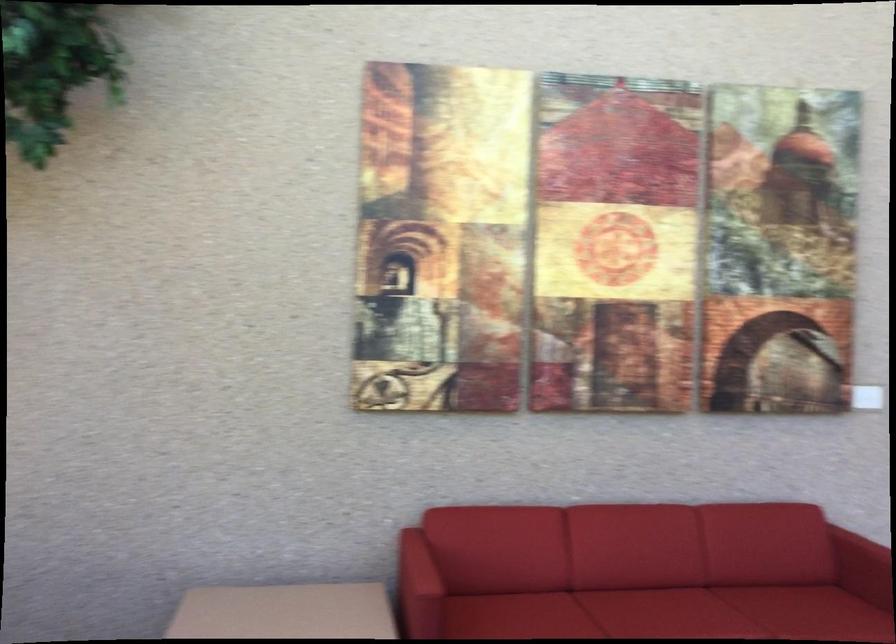
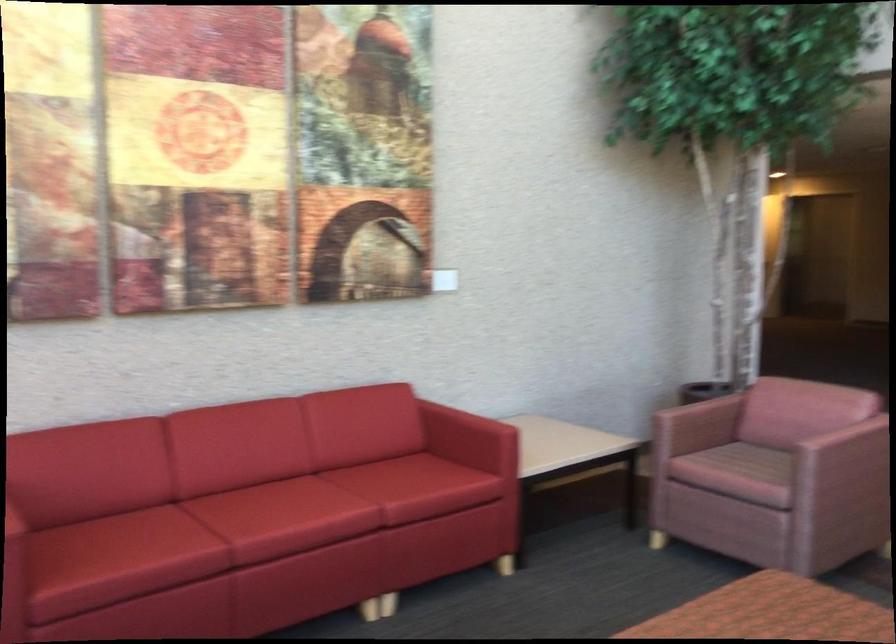
Question: The camera is either moving clockwise (left) or counter-clockwise (right) around the object. The first image is from the beginning of the video and the second image is from the end. Is the camera moving left or right when shooting the video?

Choices:
 (A) Left
 (B) Right

Answer: (A)